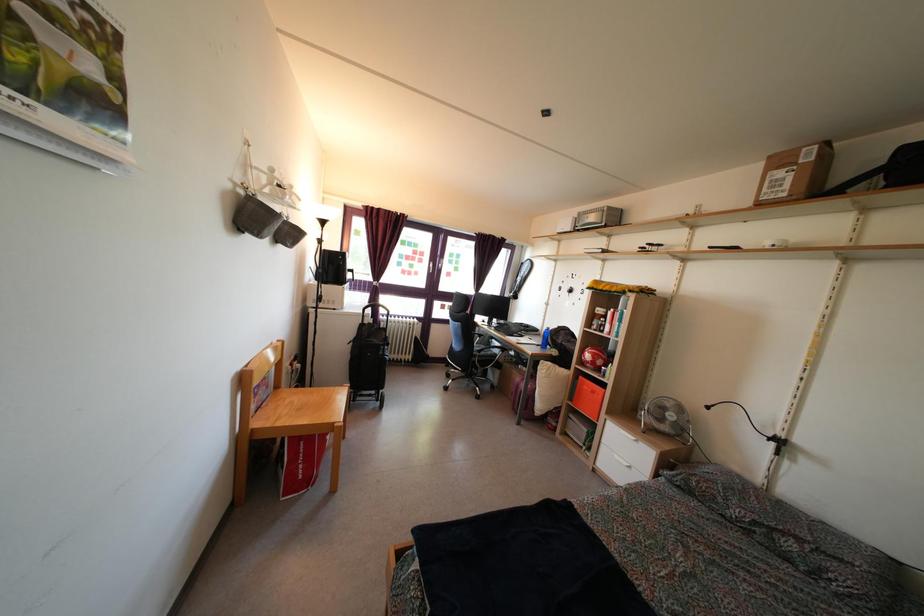
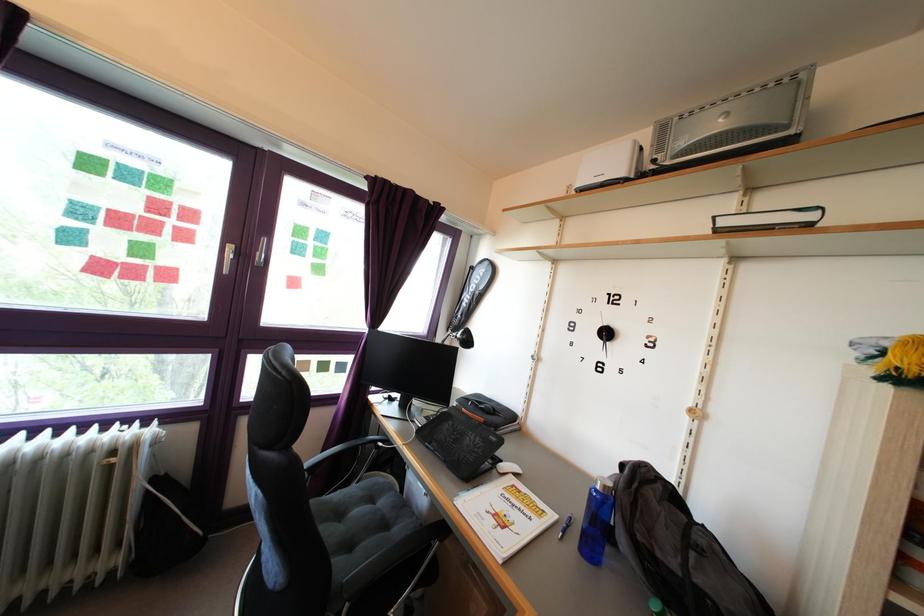
Locate, in the second image, the point that corresponds to point (572, 237) in the first image.

(625, 179)